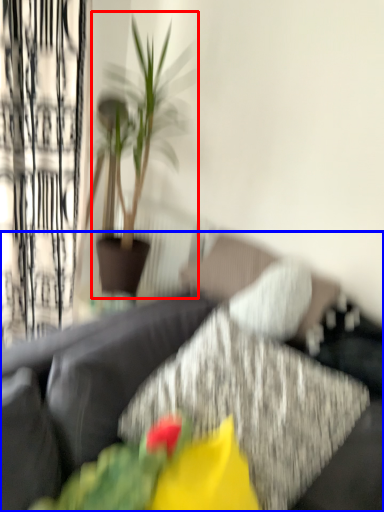
Question: Which object is closer to the camera taking this photo, houseplant (highlighted by a red box) or studio couch (highlighted by a blue box)?

Choices:
 (A) houseplant
 (B) studio couch

Answer: (B)